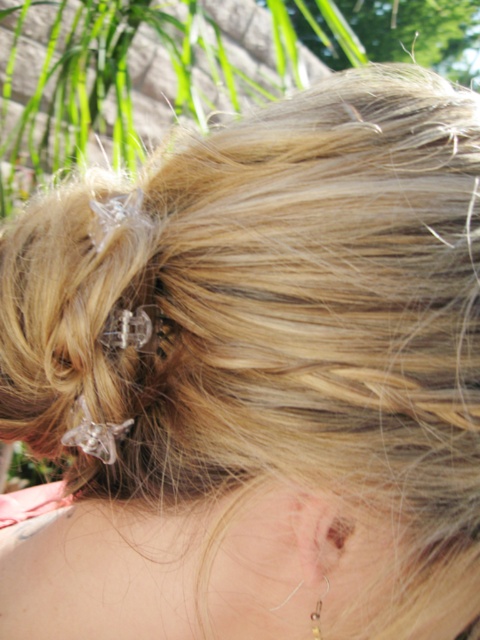
Is point (305, 563) positioned in front of point (312, 628)?

That is True.

Which is more to the left, pale skin ear at lower center or gold metallic earring at lower center?

From the viewer's perspective, pale skin ear at lower center appears more on the left side.

Does point (328, 564) lie in front of point (321, 604)?

Yes, point (328, 564) is in front of point (321, 604).

I want to click on pale skin ear at lower center, so click(x=319, y=532).